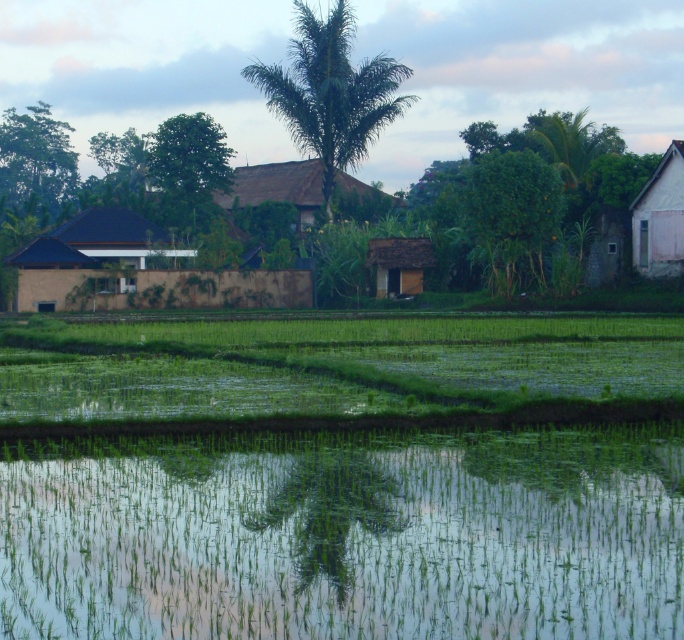
Is green grassy flood at bottom shorter than brown thatched hut at center?

Yes, green grassy flood at bottom is shorter than brown thatched hut at center.

Between point (133, 625) and point (412, 264), which one is positioned in front?

Positioned in front is point (133, 625).

Find the location of `green grassy flood at bottom`. green grassy flood at bottom is located at coordinates (345, 536).

Identify the location of green grassy flood at bottom. (345, 536).

In the scene shown: Between green grassy flood at bottom and green grassy rice field at lower center, which one appears on the right side from the viewer's perspective?

green grassy flood at bottom

Which is below, green grassy flood at bottom or green grassy rice field at lower center?

green grassy flood at bottom

This screenshot has width=684, height=640. Identify the location of green grassy flood at bottom. (345, 536).

The height and width of the screenshot is (640, 684). Identify the location of green grassy flood at bottom. (345, 536).

In the scene shown: Is green grassy flood at bottom positioned in front of brown textured hut at left?

Yes.

Is point (531, 541) in front of point (263, 291)?

Yes.

This screenshot has width=684, height=640. Identify the location of green grassy flood at bottom. (345, 536).